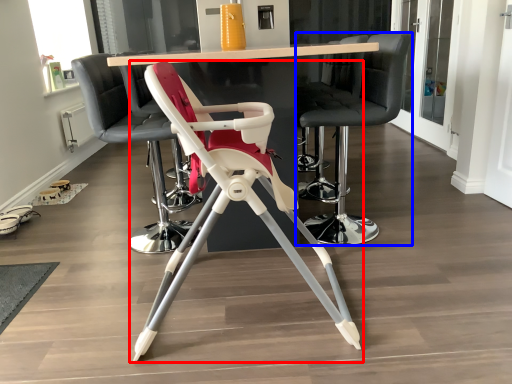
Question: Which point is further to the camera, chair (highlighted by a red box) or chair (highlighted by a blue box)?

Choices:
 (A) chair
 (B) chair

Answer: (B)